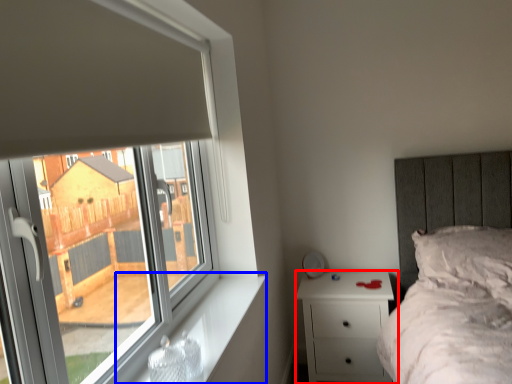
Question: Which of the following is the farthest to the observer, nightstand (highlighted by a red box) or window sill (highlighted by a blue box)?

Choices:
 (A) nightstand
 (B) window sill

Answer: (A)